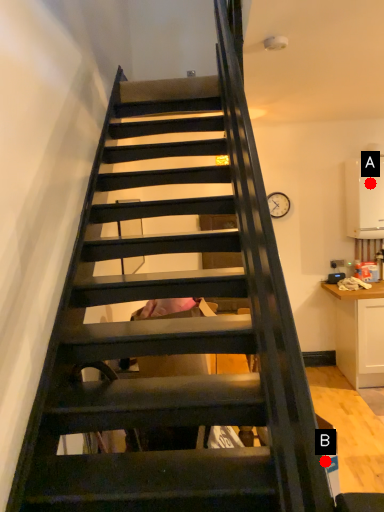
Question: Two points are circled on the image, labeled by A and B beside each circle. Which point is closer to the camera?

Choices:
 (A) A is closer
 (B) B is closer

Answer: (B)